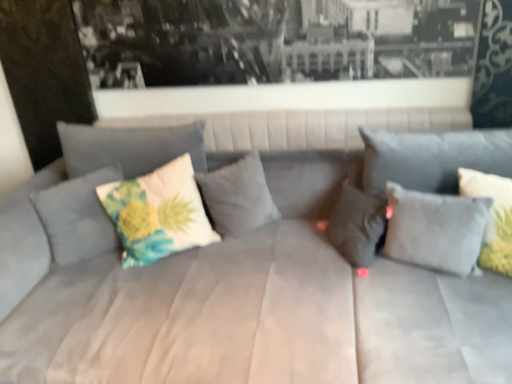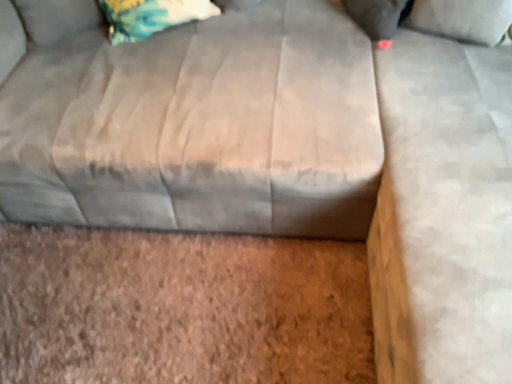
Question: How did the camera likely rotate when shooting the video?

Choices:
 (A) rotated downward
 (B) rotated upward

Answer: (A)